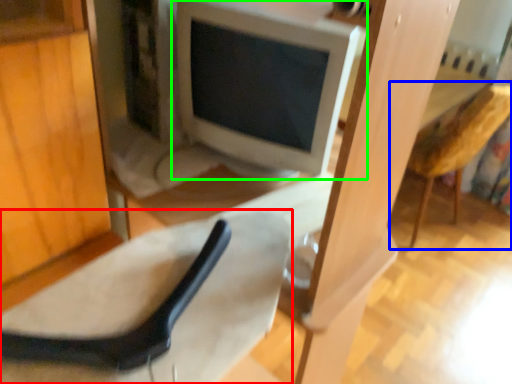
Question: Which object is the farthest from chair (highlighted by a red box)? Choose among these: armchair (highlighted by a blue box) or computer monitor (highlighted by a green box).

Choices:
 (A) armchair
 (B) computer monitor

Answer: (A)